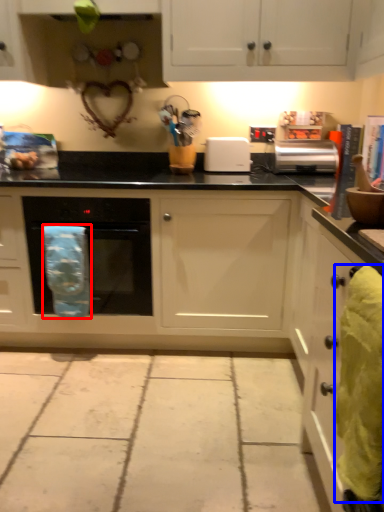
Question: Which of the following is the closest to the observer, material (highlighted by a red box) or material (highlighted by a blue box)?

Choices:
 (A) material
 (B) material

Answer: (B)